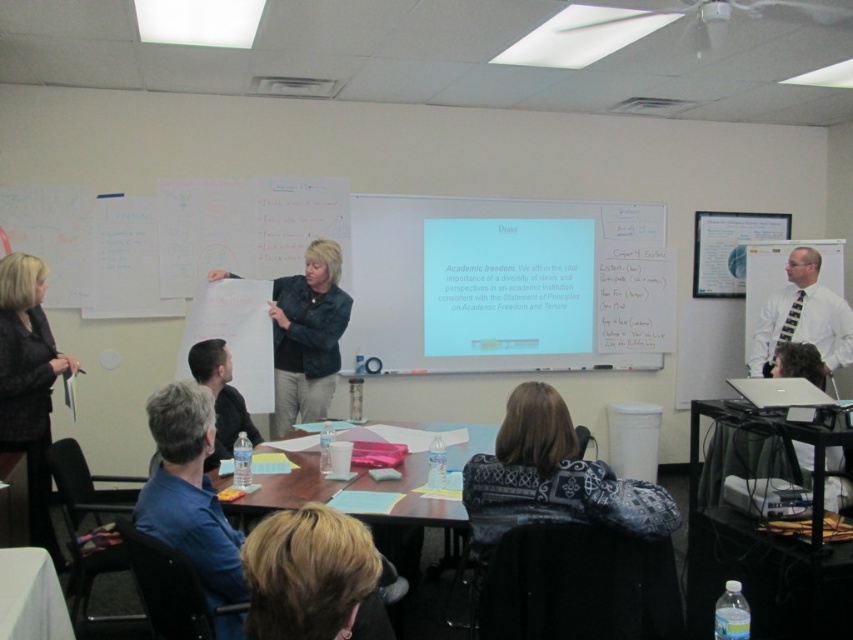
You are a photographer in the room and want to take a photo of both the black textured blazer at left and the gray fabric shirt at lower left. Which one should you focus on first to ensure both are in the frame?

The black textured blazer at left is above the gray fabric shirt at lower left, so you should focus on the gray fabric shirt at lower left first to ensure both are in the frame.

You are sitting at the rectangular table in the classroom and need to hand a document to the person wearing the black textured blazer at left. Can you reach them directly without moving from your seat?

The black textured blazer at left is located at point (x=28, y=385) which is outside the immediate vicinity of the rectangular table where you are seated. Therefore, you would need to move from your seat to reach them directly.

You are sitting at the table in the classroom and notice the blonde hair at lower center and the black textured blazer at left. Which object is positioned lower in the image?

The blonde hair at lower center is positioned below the black textured blazer at left, so it is lower in the image.